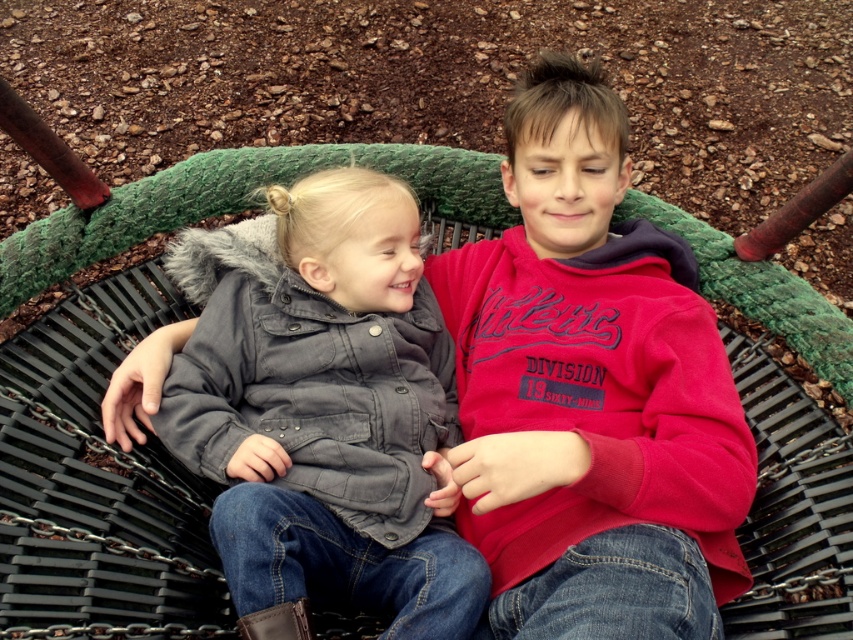
You are a photographer trying to capture the matte red hoodie at center and the gray matte jacket at center in a single shot. Which piece of clothing should you focus on first to ensure both are in frame?

The matte red hoodie at center is positioned over the gray matte jacket at center, so focusing on the matte red hoodie at center first will ensure both are visible in the frame since it is in front.

You are standing at the entrance of the playground and want to find the matte red hoodie at center. According to the coordinates provided, in which direction should you look relative to your position?

The matte red hoodie at center is located at coordinates point (590,392), so you should look towards the center of the image slightly to the right and above your current position.

You are standing in front of the swing at the playground and notice two points marked on the swing set. The first point is at coordinates point (477,522) and the second is at point (183,429). Which point is closer to you?

Point (477,522) is further to the viewer than point (183,429), so the point closer to you is point (183,429).